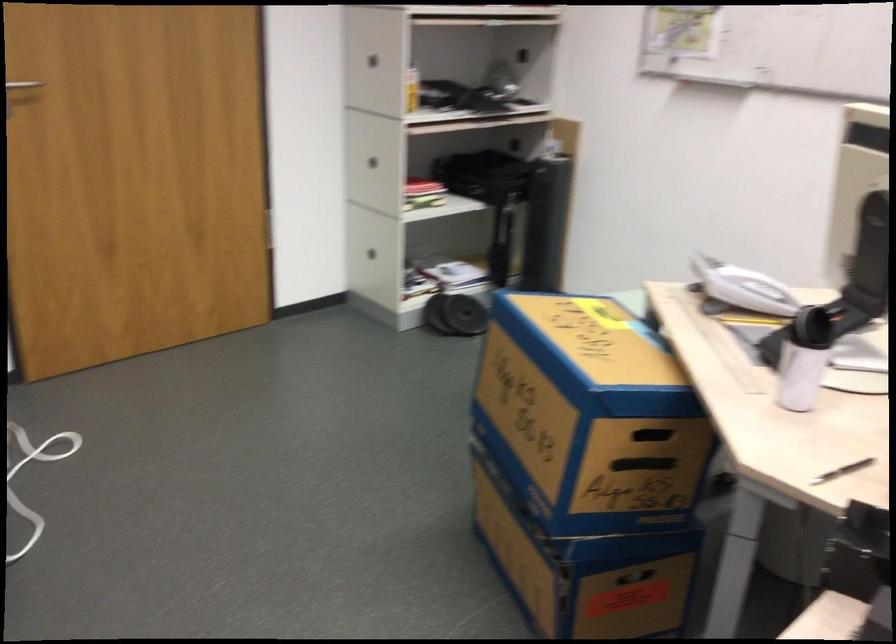
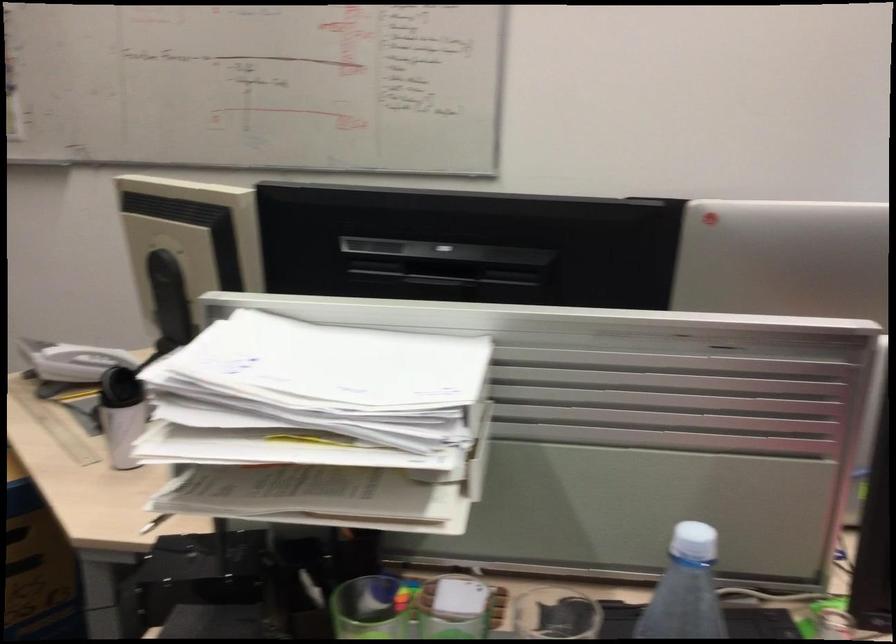
In the second image, find the point that corresponds to pixel 746 285 in the first image.

(82, 362)